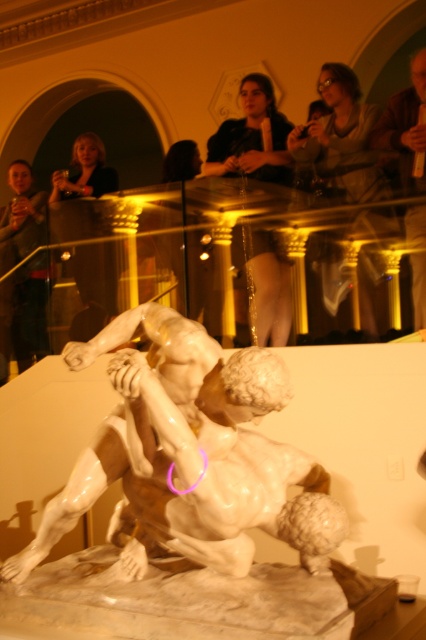
Question: Can you confirm if matte black statue at lower left is positioned to the left of matte brown jacket at upper right?

Choices:
 (A) yes
 (B) no

Answer: (A)

Question: Among these points, which one is farthest from the camera?

Choices:
 (A) (210, 440)
 (B) (416, 291)

Answer: (B)

Question: Is white glossy marble sculpture at center above matte black statue at lower left?

Choices:
 (A) yes
 (B) no

Answer: (B)

Question: Does white marble statue at center have a lesser width compared to matte brown jacket at upper right?

Choices:
 (A) yes
 (B) no

Answer: (B)

Question: Which of the following is the farthest from the observer?

Choices:
 (A) white marble statue at center
 (B) white glossy marble sculpture at center
 (C) matte black statue at lower left
 (D) matte brown jacket at upper right

Answer: (C)

Question: Which object appears farthest from the camera in this image?

Choices:
 (A) matte black statue at lower left
 (B) white marble statue at center
 (C) matte brown jacket at upper right

Answer: (A)